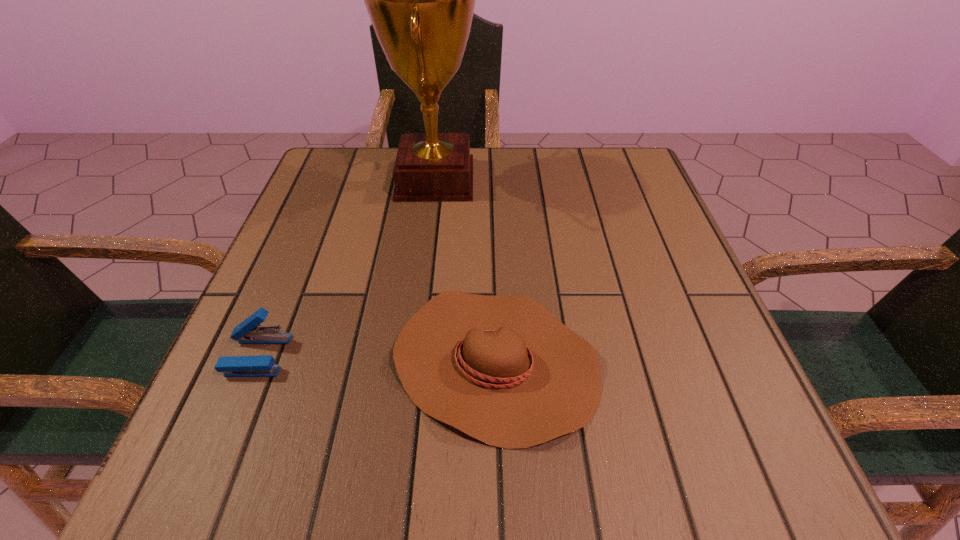
In order to click on object that is positioned at the left edge in this screenshot , I will do `click(247, 332)`.

The height and width of the screenshot is (540, 960). Identify the location of vacant position at the far edge of the desktop. (534, 186).

Where is `free space at the near edge`? free space at the near edge is located at coordinates (607, 477).

The height and width of the screenshot is (540, 960). Identify the location of vacant space at the left edge of the desktop. (297, 320).

Where is `free space at the right edge of the desktop`? free space at the right edge of the desktop is located at coordinates (684, 275).

What are the coordinates of `free space at the far left corner` in the screenshot? It's located at (364, 147).

What are the coordinates of `vacant area at the near right corner of the desktop` in the screenshot? It's located at (665, 442).

Find the location of a particular element. The height and width of the screenshot is (540, 960). free spot between the award and the stapler is located at coordinates (347, 267).

Find the location of a particular element. free space between the shortest object and the leftmost object is located at coordinates (376, 359).

Where is `free space between the leftmost object and the shortest object`? This screenshot has width=960, height=540. free space between the leftmost object and the shortest object is located at coordinates (376, 359).